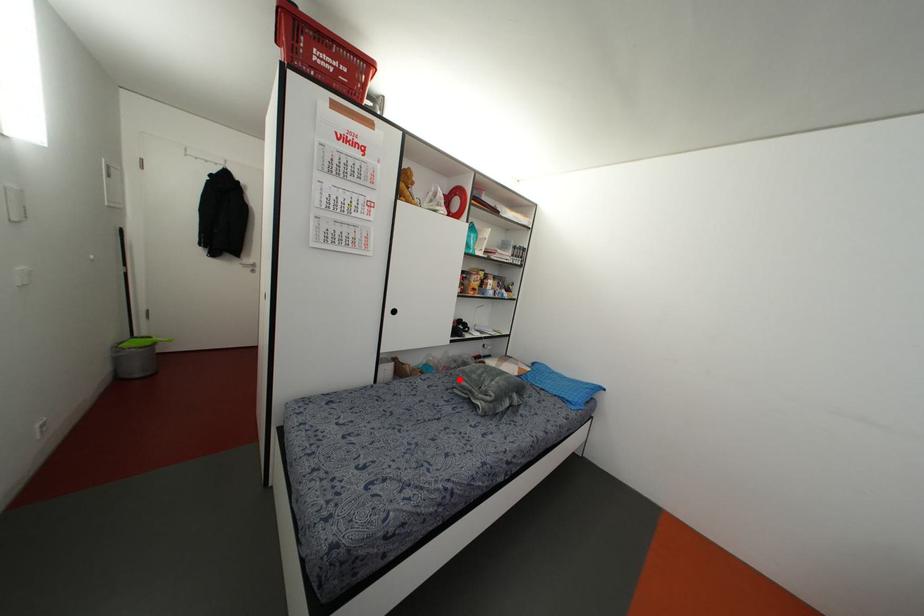
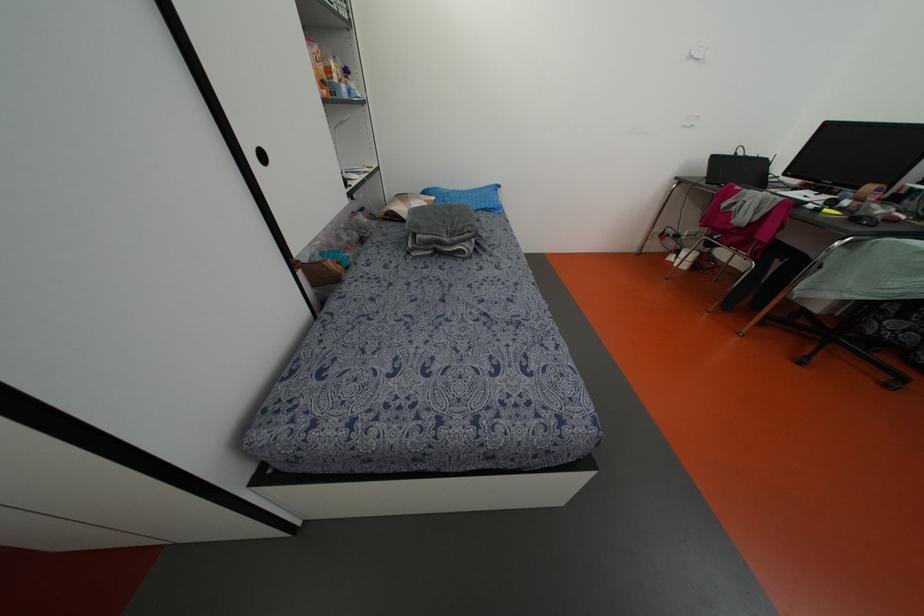
Locate, in the second image, the point that corresponds to the highlighted location in the first image.

(418, 236)